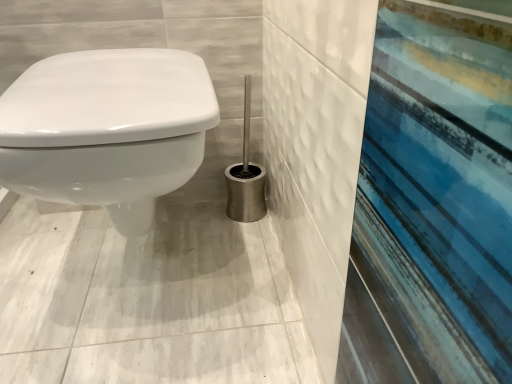
Question: Can you confirm if white glossy toilet at left is positioned to the left of satin silver toilet brush at center?

Choices:
 (A) yes
 (B) no

Answer: (A)

Question: Is the position of white glossy toilet at left less distant than that of satin silver toilet brush at center?

Choices:
 (A) no
 (B) yes

Answer: (B)

Question: Is white glossy toilet at left bigger than satin silver toilet brush at center?

Choices:
 (A) yes
 (B) no

Answer: (A)

Question: Can you confirm if white glossy toilet at left is taller than satin silver toilet brush at center?

Choices:
 (A) yes
 (B) no

Answer: (A)

Question: Does white glossy toilet at left have a lesser height compared to satin silver toilet brush at center?

Choices:
 (A) no
 (B) yes

Answer: (A)

Question: Does white glossy toilet at left have a lesser width compared to satin silver toilet brush at center?

Choices:
 (A) yes
 (B) no

Answer: (B)

Question: Considering the relative sizes of satin silver toilet brush at center and white glossy toilet at left in the image provided, is satin silver toilet brush at center wider than white glossy toilet at left?

Choices:
 (A) no
 (B) yes

Answer: (A)

Question: Does satin silver toilet brush at center have a greater height compared to white glossy toilet at left?

Choices:
 (A) no
 (B) yes

Answer: (A)

Question: Is satin silver toilet brush at center next to white glossy toilet at left?

Choices:
 (A) yes
 (B) no

Answer: (B)

Question: Is satin silver toilet brush at center not close to white glossy toilet at left?

Choices:
 (A) no
 (B) yes

Answer: (A)

Question: Can you confirm if satin silver toilet brush at center is thinner than white glossy toilet at left?

Choices:
 (A) yes
 (B) no

Answer: (A)

Question: From the image's perspective, is satin silver toilet brush at center above white glossy toilet at left?

Choices:
 (A) no
 (B) yes

Answer: (B)

Question: From the image's perspective, is satin silver toilet brush at center above or below white glossy toilet at left?

Choices:
 (A) above
 (B) below

Answer: (A)